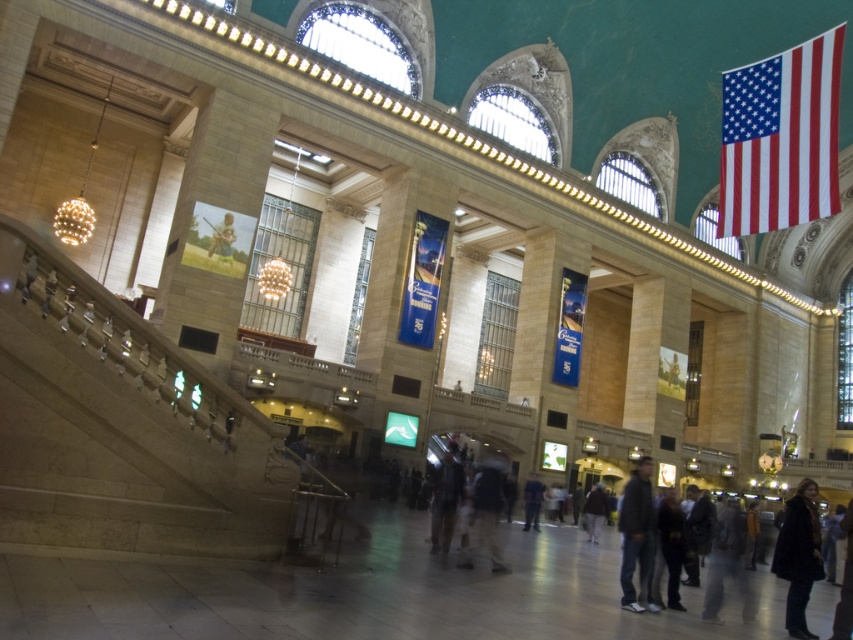
Question: Which point is farther to the camera?

Choices:
 (A) dark blue jeans at center
 (B) dark gray fabric jacket at center
 (C) red-white striped flag at upper right

Answer: (C)

Question: From the image, what is the correct spatial relationship of dark gray fabric jacket at center in relation to dark brown leather jacket at center?

Choices:
 (A) left
 (B) right

Answer: (A)

Question: Does dark gray fabric jacket at center lie in front of light brown wooden chair at center?

Choices:
 (A) no
 (B) yes

Answer: (B)

Question: Which object appears farthest from the camera in this image?

Choices:
 (A) dark brown leather jacket at center
 (B) dark gray fabric jacket at center
 (C) red-white striped flag at upper right
 (D) light brown fabric pants at center

Answer: (C)

Question: Can you confirm if dark gray fabric jacket at center is wider than dark blue jeans at center?

Choices:
 (A) no
 (B) yes

Answer: (A)

Question: Which point is farther from the camera taking this photo?

Choices:
 (A) (x=664, y=518)
 (B) (x=527, y=500)

Answer: (B)